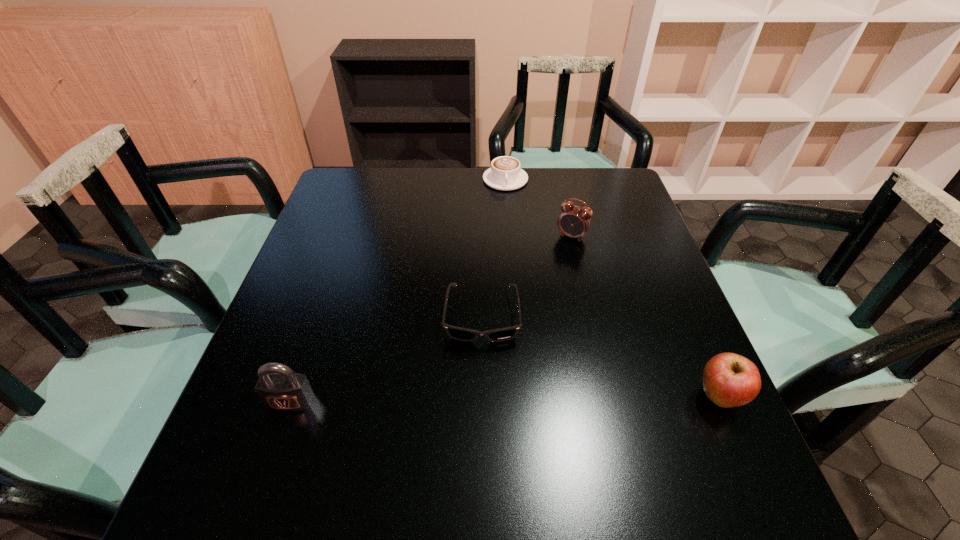
Locate an element on the screen. vacant area that lies between the leftmost object and the cappuccino is located at coordinates (398, 291).

I want to click on vacant space in between the alarm clock and the leftmost object, so click(x=431, y=319).

Identify the location of vacant area between the rightmost object and the second object from right to left. 645,316.

I want to click on vacant space that's between the third farthest object and the cappuccino, so click(493, 248).

You are a GUI agent. You are given a task and a screenshot of the screen. Output one action in this format:
    pyautogui.click(x=<x>, y=<y>)
    Task: Click on the free space between the farthest object and the sunglasses
    The height and width of the screenshot is (540, 960).
    Given the screenshot: What is the action you would take?
    pyautogui.click(x=493, y=248)

You are a GUI agent. You are given a task and a screenshot of the screen. Output one action in this format:
    pyautogui.click(x=<x>, y=<y>)
    Task: Click on the free space between the second farthest object and the rightmost object
    The width and height of the screenshot is (960, 540).
    Given the screenshot: What is the action you would take?
    pyautogui.click(x=645, y=316)

The width and height of the screenshot is (960, 540). Find the location of `unoccupied area between the cappuccino and the padlock`. unoccupied area between the cappuccino and the padlock is located at coordinates (398, 291).

I want to click on free area in between the farthest object and the leftmost object, so click(398, 291).

Locate an element on the screen. The height and width of the screenshot is (540, 960). vacant area that lies between the leftmost object and the third farthest object is located at coordinates (386, 360).

Locate which object ranks third in proximity to the rightmost object. Please provide its 2D coordinates. Your answer should be formatted as a tuple, i.e. [(x, y)], where the tuple contains the x and y coordinates of a point satisfying the conditions above.

[(505, 173)]